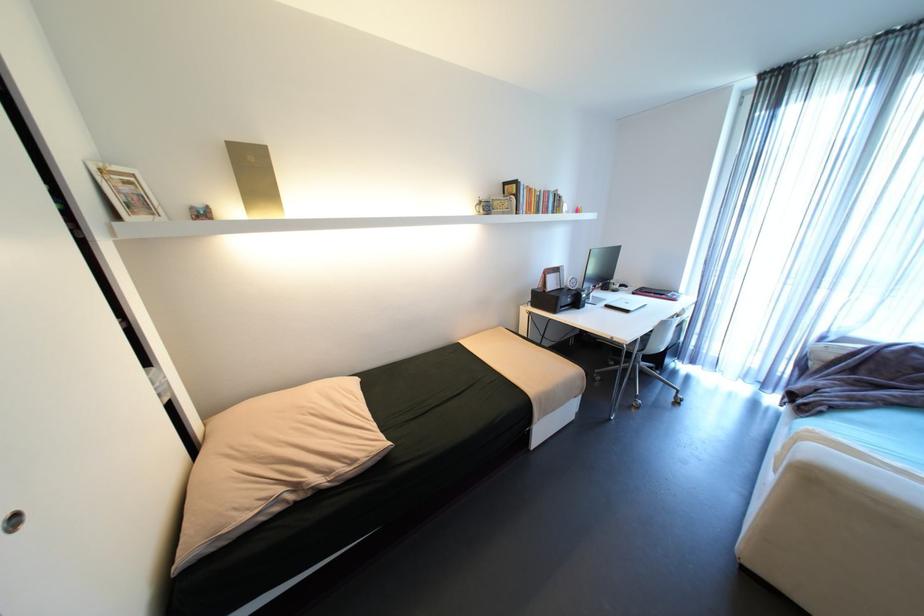
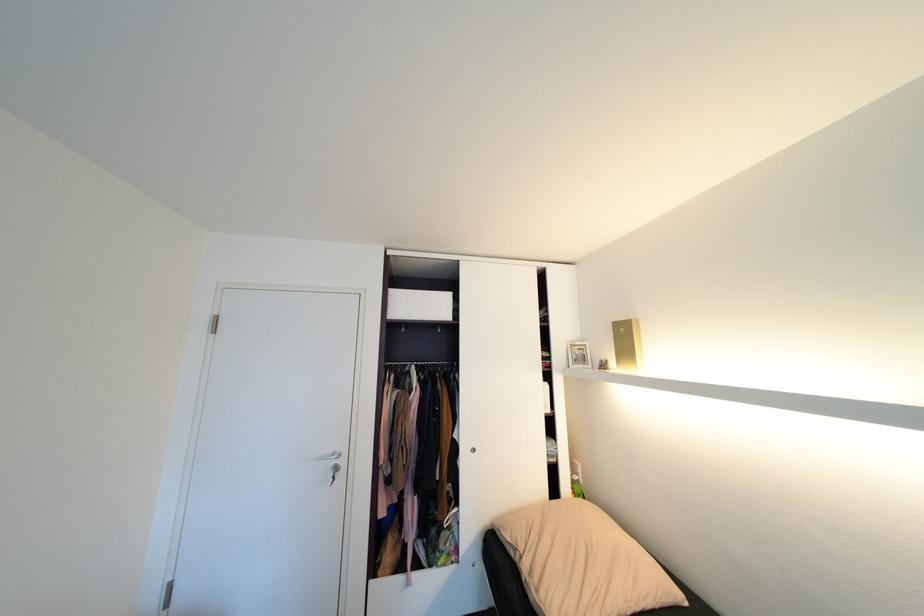
In the second image, find the point that corresponds to (285,509) in the first image.

(518, 554)